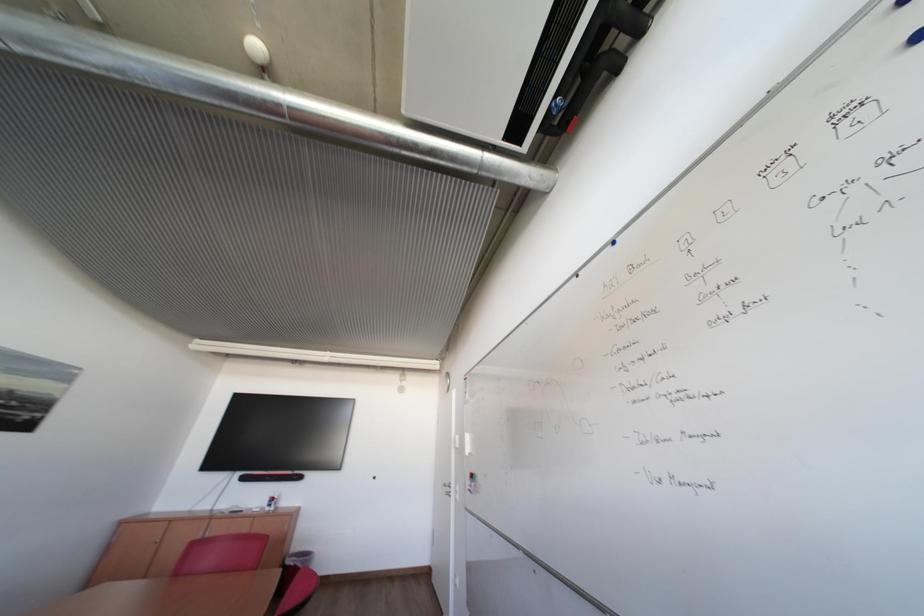
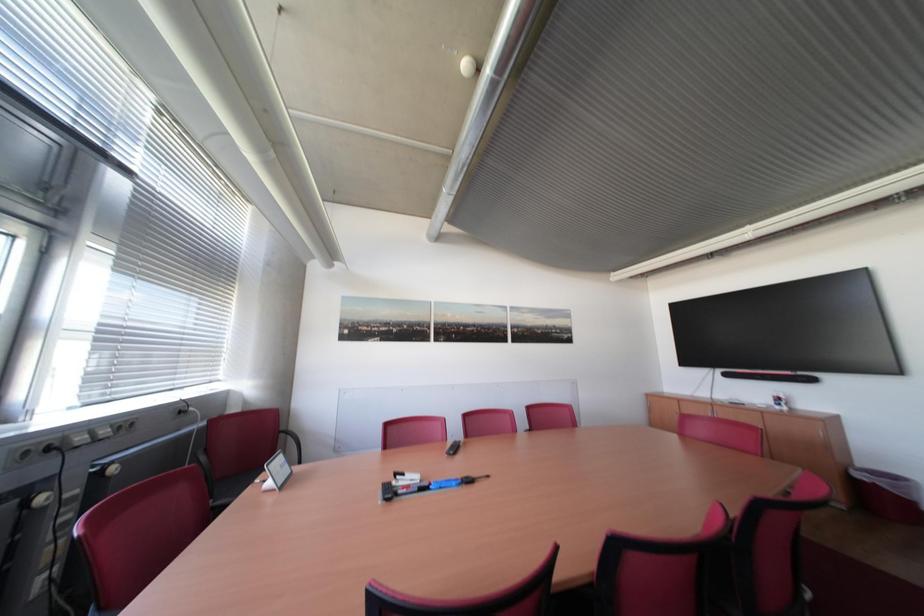
Question: The camera is either moving clockwise (left) or counter-clockwise (right) around the object. The first image is from the beginning of the video and the second image is from the end. Is the camera moving left or right when shooting the video?

Choices:
 (A) Left
 (B) Right

Answer: (B)